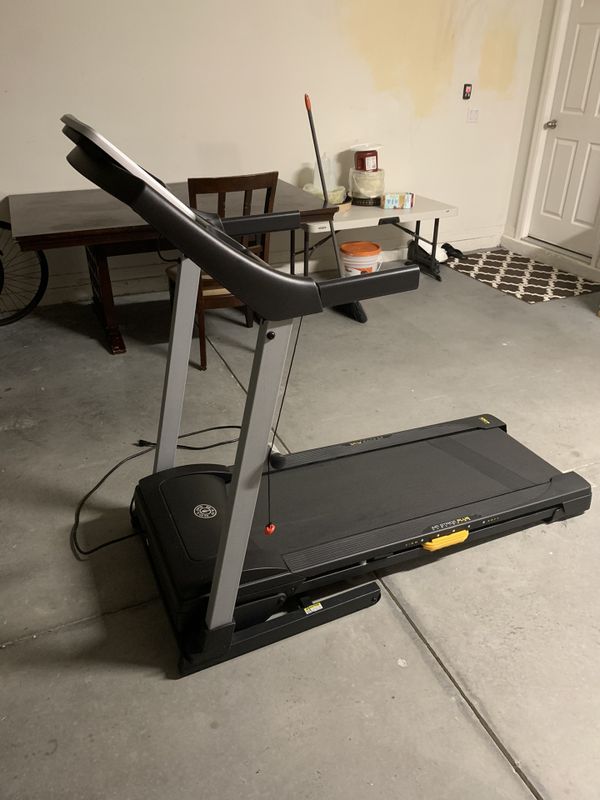
At what (x,y) coordinates should I click in order to perform the action: click on plug. Please return your answer as a coordinate pair (x, y). The height and width of the screenshot is (800, 600). Looking at the image, I should click on (137, 445).